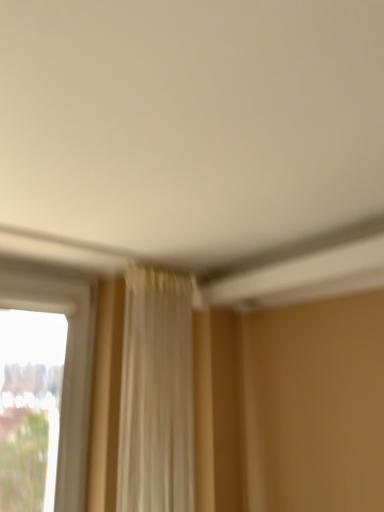
Describe the element at coordinates (156, 394) in the screenshot. I see `white sheer curtain at center` at that location.

At what (x,y) coordinates should I click in order to perform the action: click on white sheer curtain at center. Please return your answer as a coordinate pair (x, y). The width and height of the screenshot is (384, 512). Looking at the image, I should click on (156, 394).

I want to click on white sheer curtain at center, so click(x=156, y=394).